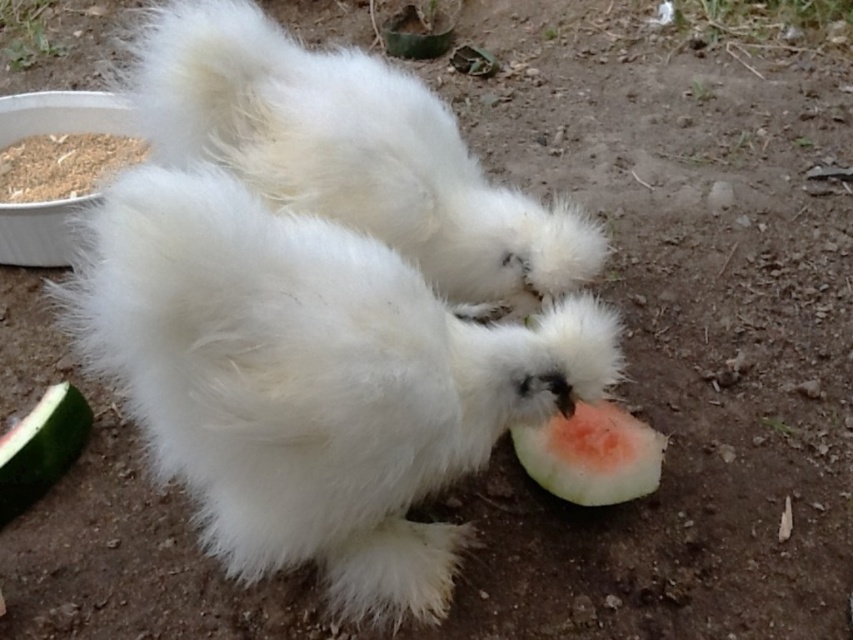
This screenshot has height=640, width=853. What do you see at coordinates (592, 454) in the screenshot?
I see `pink flesh watermelon at lower center` at bounding box center [592, 454].

Is point (583, 442) more distant than point (70, 403)?

No, it is not.

Which is behind, point (598, 426) or point (45, 444)?

Point (45, 444)

This screenshot has width=853, height=640. I want to click on pink flesh watermelon at lower center, so click(x=592, y=454).